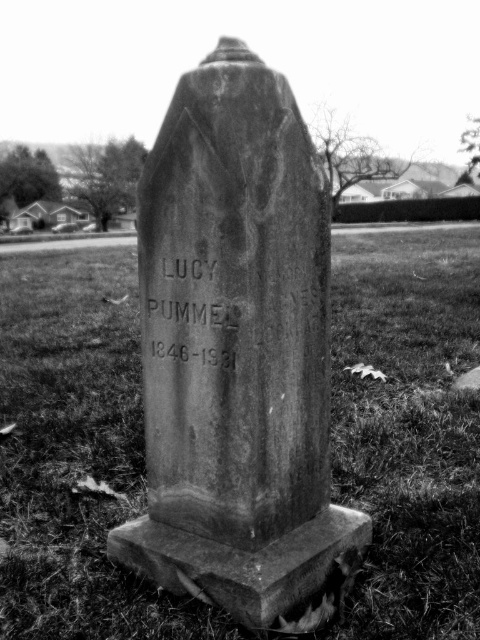
Question: Does grassy at center have a smaller size compared to granite gravestone at center?

Choices:
 (A) yes
 (B) no

Answer: (B)

Question: Observing the image, what is the correct spatial positioning of grassy at center in reference to granite gravestone at center?

Choices:
 (A) left
 (B) right

Answer: (A)

Question: Which object is closer to the camera taking this photo?

Choices:
 (A) grassy at center
 (B) granite gravestone at center

Answer: (B)

Question: Which point is farther to the camera?

Choices:
 (A) [x=358, y=429]
 (B) [x=285, y=419]

Answer: (A)

Question: Can you confirm if grassy at center is smaller than granite gravestone at center?

Choices:
 (A) yes
 (B) no

Answer: (B)